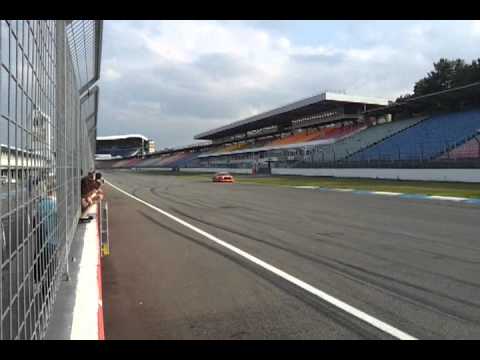
The image size is (480, 360). I want to click on stands, so click(433, 137), click(378, 135), click(459, 150), click(174, 157), click(154, 159), click(135, 161), click(128, 163), click(300, 137), click(334, 135).